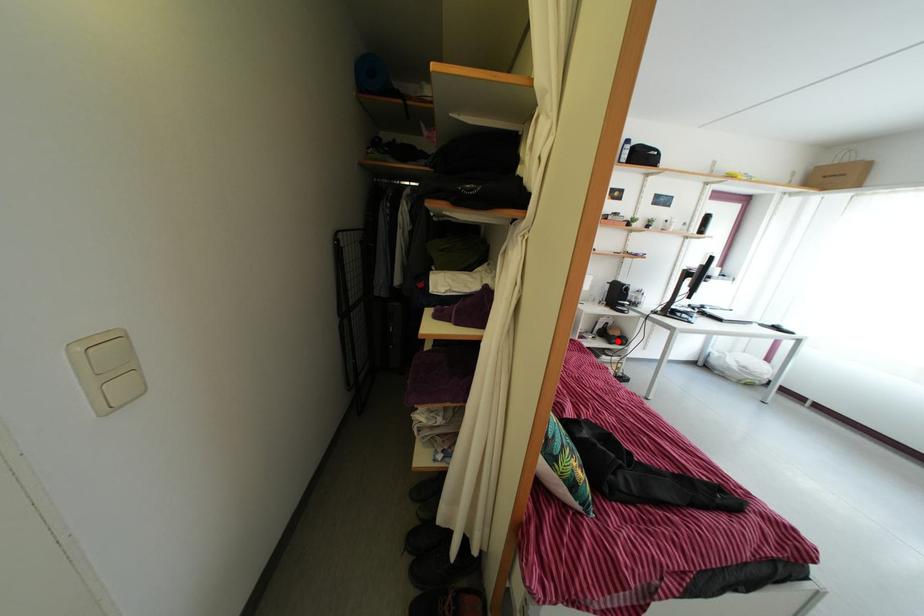
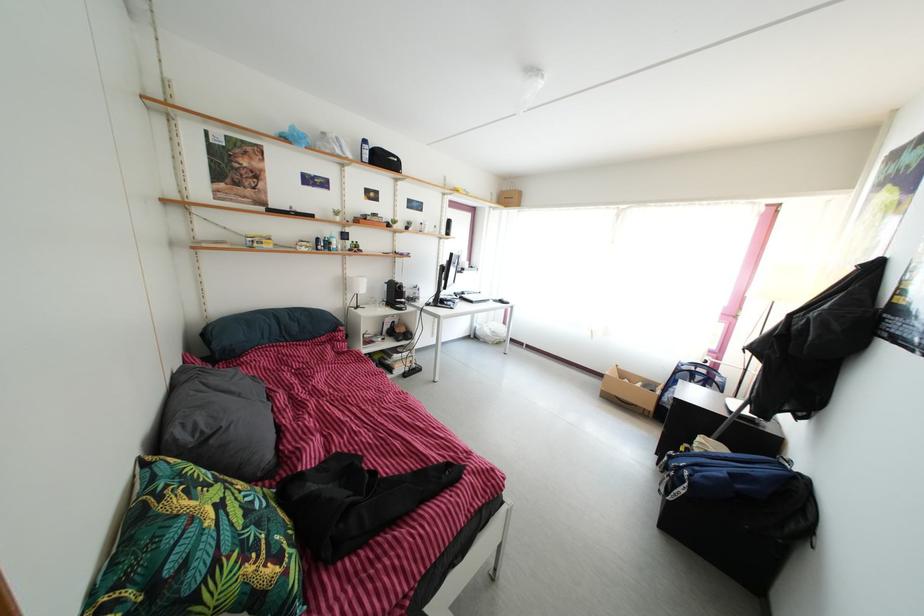
Find the pixel in the second image that matches the highlighted location in the first image.

(405, 339)